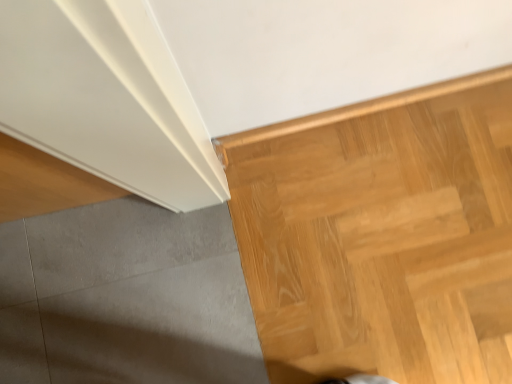
This screenshot has height=384, width=512. Identify the location of wooden parquet floor at lower right. pyautogui.click(x=382, y=236).

The height and width of the screenshot is (384, 512). Describe the element at coordinates (382, 236) in the screenshot. I see `wooden parquet floor at lower right` at that location.

Find the location of a particular element. wooden parquet floor at lower right is located at coordinates (382, 236).